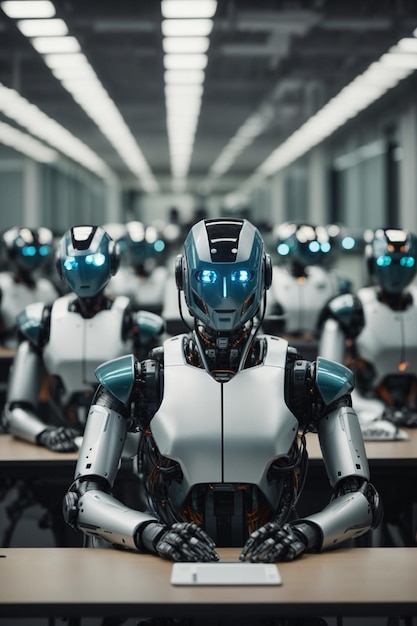
The image size is (417, 626). I want to click on chest, so click(206, 413), click(89, 344), click(29, 290), click(146, 287), click(173, 303), click(296, 295), click(377, 337), click(350, 270).